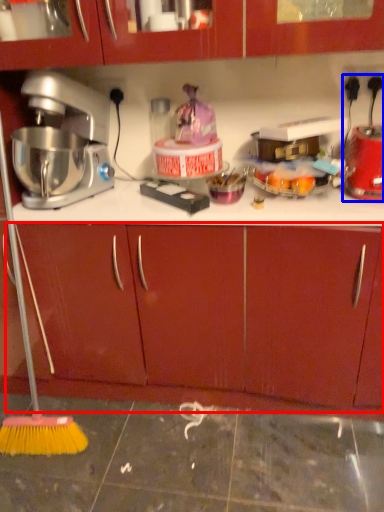
Question: Which of the following is the farthest to the observer, drawer (highlighted by a red box) or blender (highlighted by a blue box)?

Choices:
 (A) drawer
 (B) blender

Answer: (B)